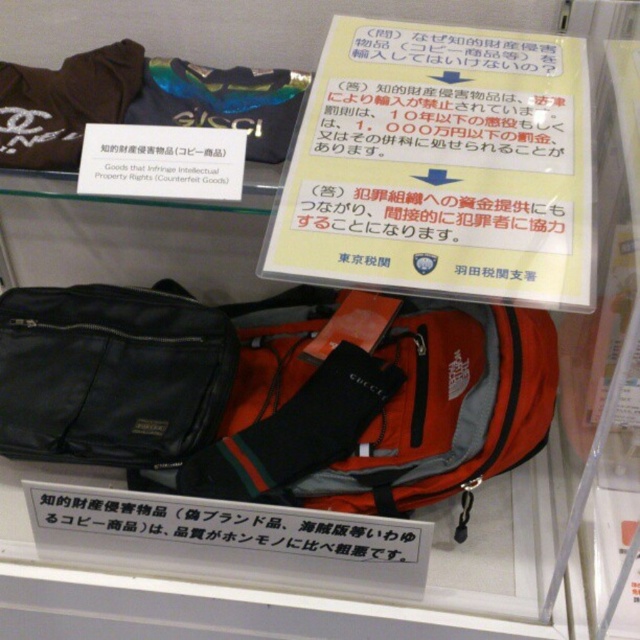
Question: Is yellow paper at upper center positioned at the back of matte black bag at left?

Choices:
 (A) yes
 (B) no

Answer: (B)

Question: Estimate the real-world distances between objects in this image. Which object is farther from the orange fabric backpack at center?

Choices:
 (A) matte black bag at left
 (B) yellow paper at upper center
 (C) white paper sign at center

Answer: (B)

Question: Which of the following is the closest to the observer?

Choices:
 (A) (65, 460)
 (B) (138, 550)
 (C) (440, 454)
 (D) (380, 36)

Answer: (C)

Question: Is yellow paper at upper center closer to the viewer compared to orange fabric backpack at center?

Choices:
 (A) no
 (B) yes

Answer: (B)

Question: Does yellow paper at upper center have a greater width compared to white paper sign at center?

Choices:
 (A) no
 (B) yes

Answer: (A)

Question: Which of the following is the closest to the observer?

Choices:
 (A) (362, 545)
 (B) (337, 97)
 (C) (92, 448)
 (D) (388, 474)

Answer: (A)